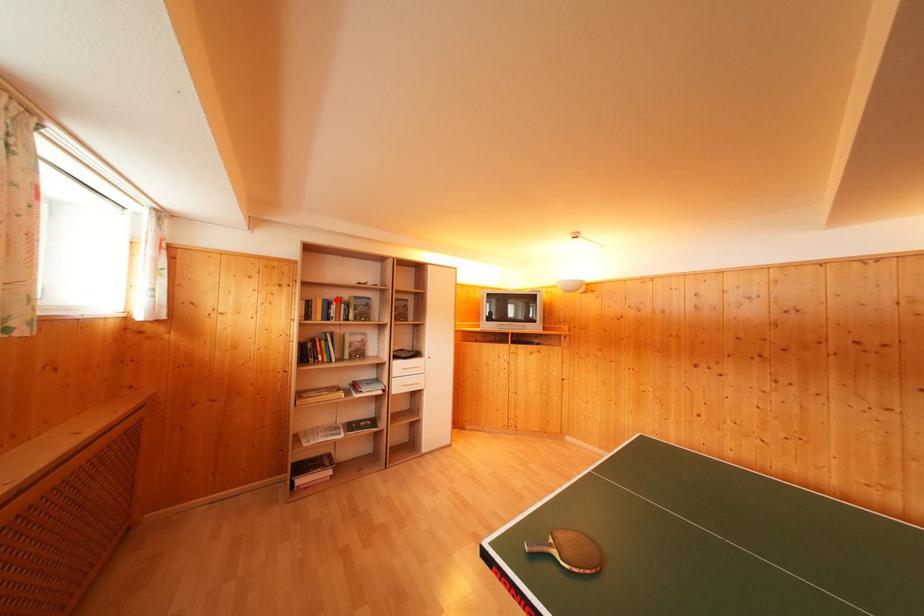
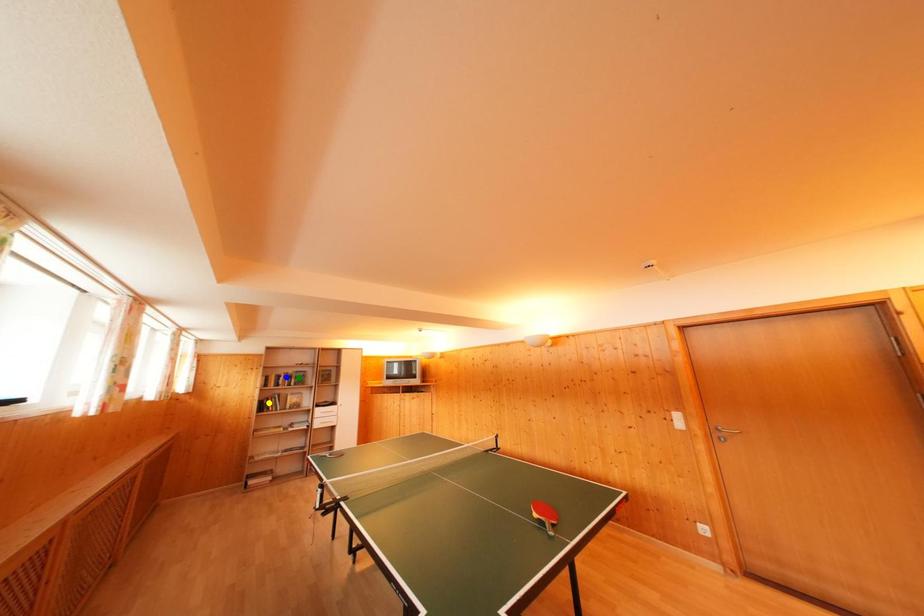
Question: I am providing you with two images of the same scene from different viewpoints. A red point is marked on the first image. You are given multiple points on the second image. Can you choose the point in image 2 that corresponds to the point in image 1?

Choices:
 (A) yellow point
 (B) blue point
 (C) green point

Answer: (B)